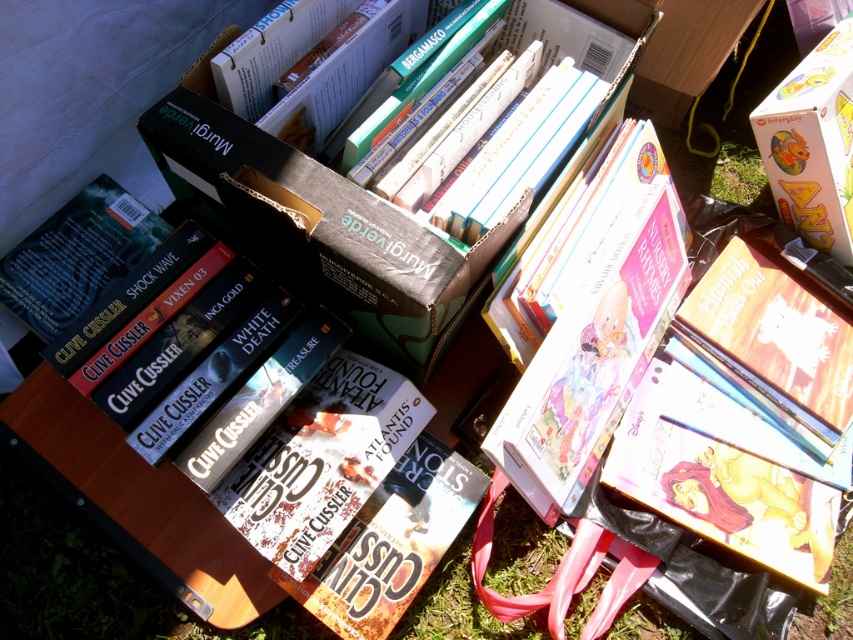
Who is higher up, hardcover book at center or yellow cardboard box at upper right?

yellow cardboard box at upper right is higher up.

Measure the distance between hardcover book at center and camera.

They are 3.29 feet apart.

Between point (47, 506) and point (798, 216), which one is positioned behind?

Positioned behind is point (798, 216).

At what (x,y) coordinates should I click in order to perform the action: click on hardcover book at center. Please return your answer as a coordinate pair (x, y). Looking at the image, I should click on (68, 573).

Is yellow cardboard box at upper right smaller than green grass at lower right?

No.

I want to click on yellow cardboard box at upper right, so click(x=811, y=145).

This screenshot has height=640, width=853. Find the location of `hardcover book at center`. hardcover book at center is located at coordinates (68, 573).

Between point (483, 342) and point (722, 145), which one is positioned in front?

Point (483, 342)

You are a GUI agent. You are given a task and a screenshot of the screen. Output one action in this format:
    pyautogui.click(x=<x>, y=<y>)
    Task: Click on the hardcover book at center
    
    Given the screenshot: What is the action you would take?
    pyautogui.click(x=68, y=573)